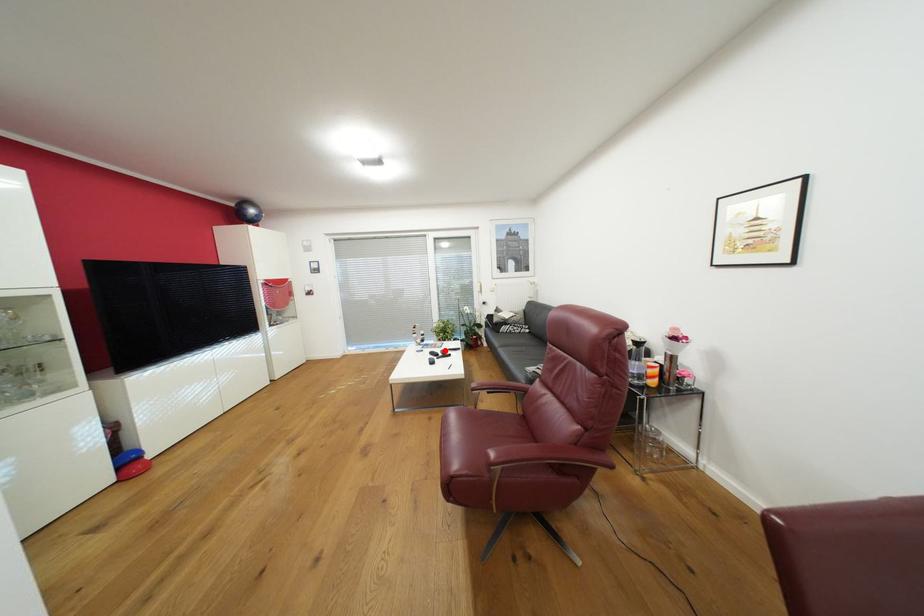
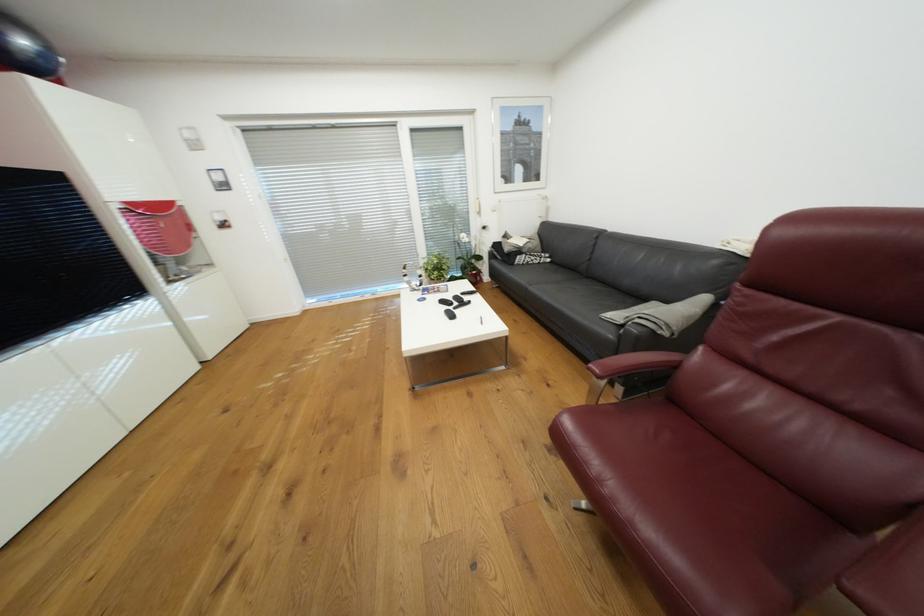
Question: A red point is marked in image1. In image2, is the corresponding 3D point closer to the camera or farther? Reply with the corresponding letter.

Choices:
 (A) The corresponding 3D point is closer.
 (B) The corresponding 3D point is farther.

Answer: (B)